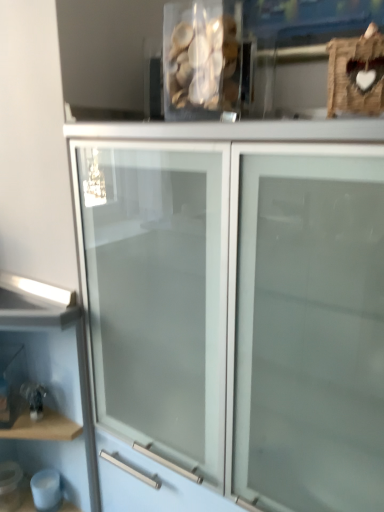
Question: Is white frosted glass cabinet at center thinner than translucent plastic container at upper center?

Choices:
 (A) yes
 (B) no

Answer: (B)

Question: From a real-world perspective, is white frosted glass cabinet at center below translucent plastic container at upper center?

Choices:
 (A) no
 (B) yes

Answer: (B)

Question: Considering the relative sizes of white frosted glass cabinet at center and translucent plastic container at upper center in the image provided, is white frosted glass cabinet at center wider than translucent plastic container at upper center?

Choices:
 (A) yes
 (B) no

Answer: (A)

Question: Is white frosted glass cabinet at center closer to camera compared to translucent plastic container at upper center?

Choices:
 (A) no
 (B) yes

Answer: (B)

Question: From the image's perspective, does white frosted glass cabinet at center appear lower than translucent plastic container at upper center?

Choices:
 (A) no
 (B) yes

Answer: (B)

Question: From a real-world perspective, is wooden shelf at lower left positioned above or below white frosted glass cabinet at center?

Choices:
 (A) above
 (B) below

Answer: (B)

Question: From the image's perspective, is wooden shelf at lower left located above or below white frosted glass cabinet at center?

Choices:
 (A) below
 (B) above

Answer: (A)

Question: Considering the positions of point (38, 353) and point (236, 232), is point (38, 353) closer or farther from the camera than point (236, 232)?

Choices:
 (A) closer
 (B) farther

Answer: (B)

Question: In terms of height, does wooden shelf at lower left look taller or shorter compared to white frosted glass cabinet at center?

Choices:
 (A) tall
 (B) short

Answer: (B)

Question: In the image, is white frosted glass cabinet at center positioned in front of or behind translucent plastic container at upper center?

Choices:
 (A) front
 (B) behind

Answer: (A)

Question: Visually, is white frosted glass cabinet at center positioned to the left or to the right of translucent plastic container at upper center?

Choices:
 (A) left
 (B) right

Answer: (B)

Question: Considering the positions of white frosted glass cabinet at center and translucent plastic container at upper center in the image, is white frosted glass cabinet at center taller or shorter than translucent plastic container at upper center?

Choices:
 (A) short
 (B) tall

Answer: (B)

Question: Does point (180, 324) appear closer or farther from the camera than point (190, 52)?

Choices:
 (A) closer
 (B) farther

Answer: (A)

Question: In terms of width, does wooden shelf at lower left look wider or thinner when compared to translucent plastic container at upper center?

Choices:
 (A) wide
 (B) thin

Answer: (A)

Question: Is wooden shelf at lower left spatially inside translucent plastic container at upper center, or outside of it?

Choices:
 (A) inside
 (B) outside

Answer: (B)